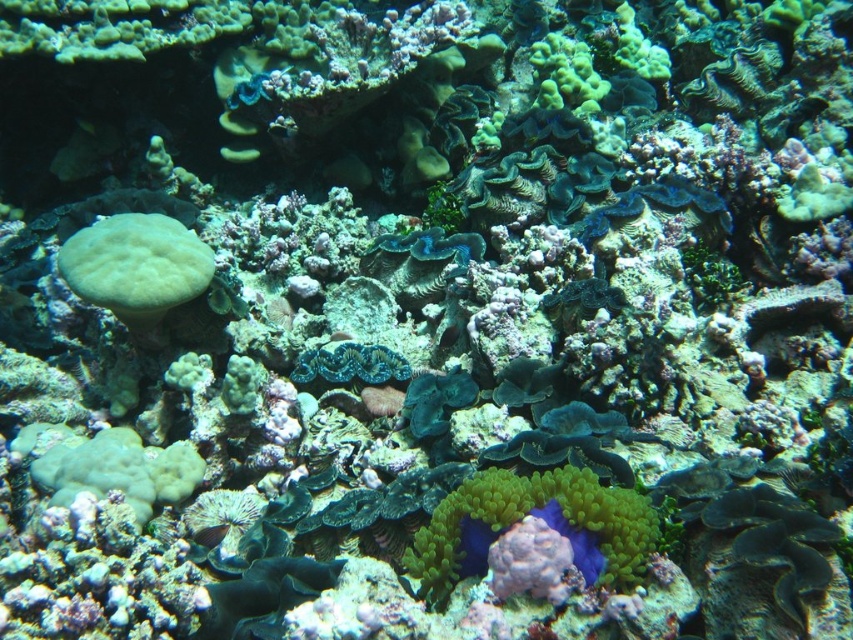
Does green soft coral at center have a larger size compared to blue-green textured coral at center?

Indeed, green soft coral at center has a larger size compared to blue-green textured coral at center.

Does green soft coral at center have a smaller size compared to blue-green textured coral at center?

Actually, green soft coral at center might be larger than blue-green textured coral at center.

Between point (488, 497) and point (345, 353), which one is positioned in front?

Point (488, 497) is in front.

The height and width of the screenshot is (640, 853). I want to click on green soft coral at center, so click(x=537, y=516).

Which of these two, green matte coral at left or blue-green textured coral at center, stands taller?

green matte coral at left is taller.

The image size is (853, 640). In order to click on green matte coral at left in this screenshot , I will do `click(136, 268)`.

Between point (538, 515) and point (96, 292), which one is positioned behind?

The point (96, 292) is more distant.

Does point (442, 568) come closer to viewer compared to point (142, 257)?

Yes, it is in front of point (142, 257).

What are the coordinates of `green soft coral at center` in the screenshot? It's located at (537, 516).